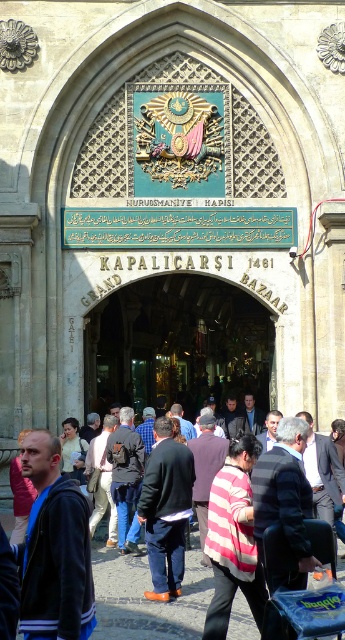
You are a tourist standing at the entrance of the Grand Bazaar and see the striped fabric crowd at center and the dark blue jeans at center. Which object is positioned lower in the scene?

The striped fabric crowd at center is located below dark blue jeans at center, so the striped fabric crowd at center is positioned lower in the scene.

You are a tourist standing at the entrance of the Grand Bazaar and see the dark blue jacket at lower left and the striped fabric crowd at center. Which object is closer to you?

The dark blue jacket at lower left is closer to you since it is in front of the striped fabric crowd at center.